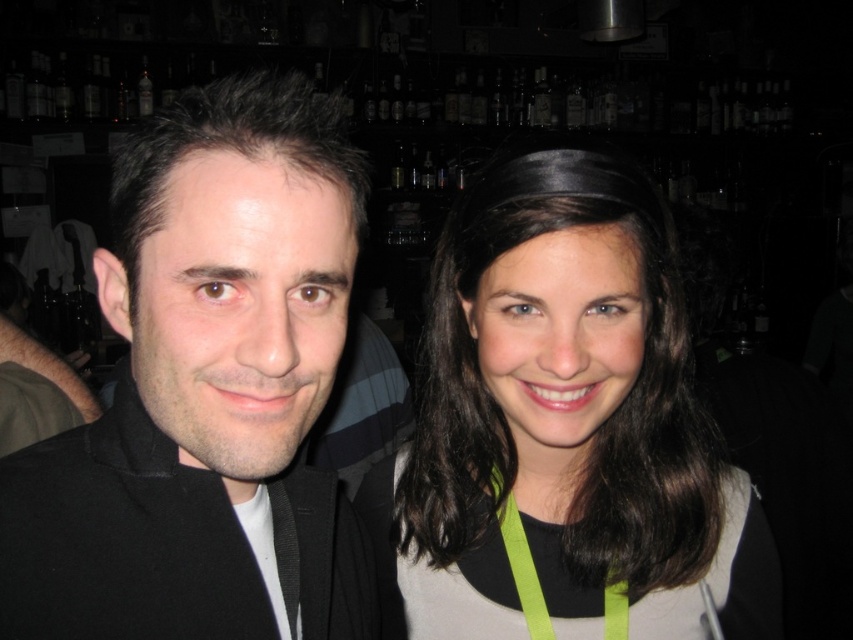
Question: Observing the image, what is the correct spatial positioning of smooth brown hair at center in reference to green fabric lanyard at center?

Choices:
 (A) above
 (B) below

Answer: (A)

Question: Which object is farther from the camera taking this photo?

Choices:
 (A) green fabric lanyard at center
 (B) black matte jacket at left

Answer: (A)

Question: Estimate the real-world distances between objects in this image. Which object is closer to the black matte jacket at left?

Choices:
 (A) smooth brown hair at center
 (B) green fabric lanyard at center

Answer: (A)

Question: Is smooth brown hair at center bigger than green fabric lanyard at center?

Choices:
 (A) yes
 (B) no

Answer: (A)

Question: Which of the following is the closest to the observer?

Choices:
 (A) green fabric lanyard at center
 (B) smooth brown hair at center
 (C) black matte jacket at left

Answer: (C)

Question: Does smooth brown hair at center appear under green fabric lanyard at center?

Choices:
 (A) yes
 (B) no

Answer: (B)